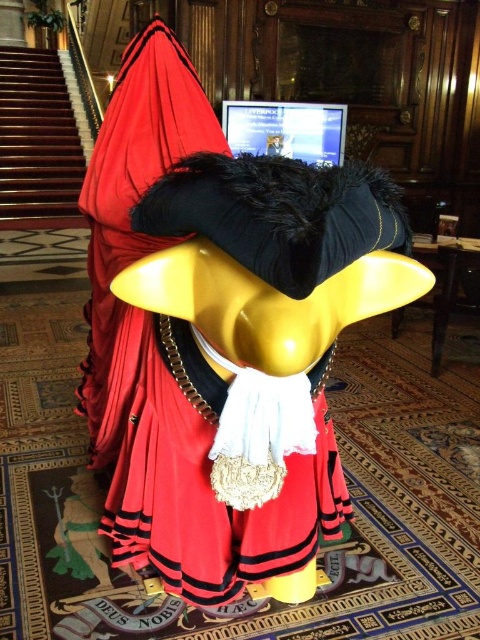
Consider the image. Who is higher up, wooden staircase at left or shiny black laptop at upper center?

Positioned higher is wooden staircase at left.

Can you confirm if wooden staircase at left is positioned to the left of shiny black laptop at upper center?

Yes, wooden staircase at left is to the left of shiny black laptop at upper center.

Locate an element on the screen. Image resolution: width=480 pixels, height=640 pixels. wooden staircase at left is located at coordinates (36, 141).